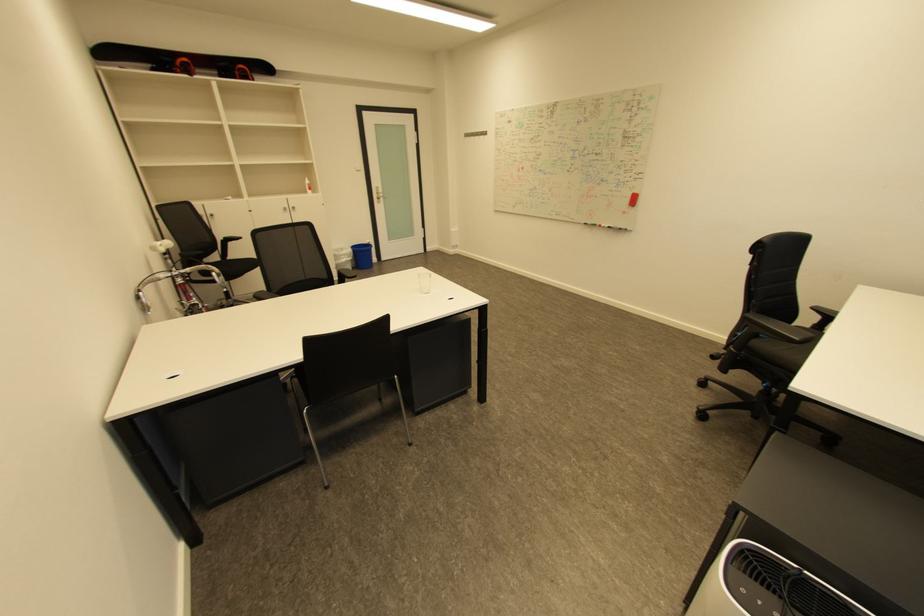
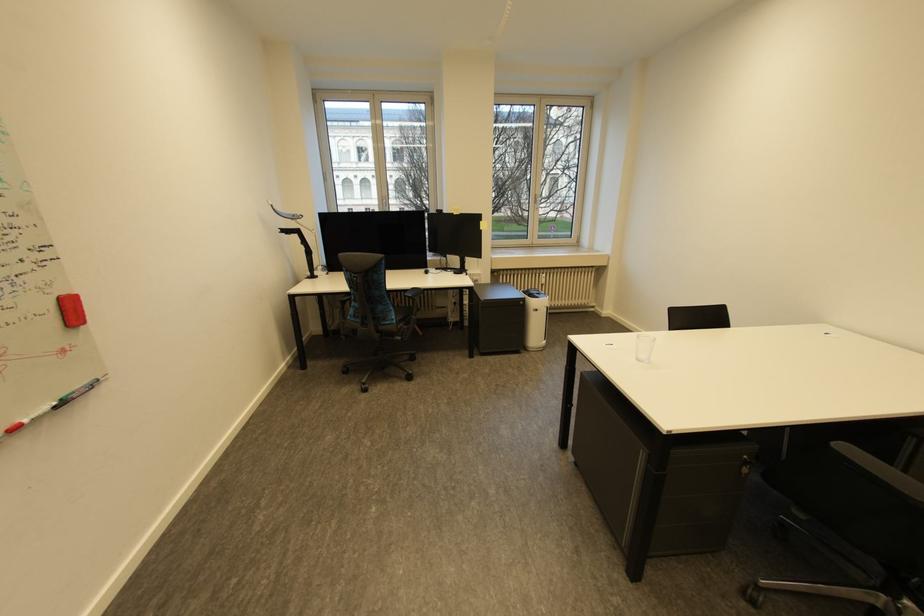
In the second image, find the point that corresponds to [604,225] in the first image.

(6, 436)